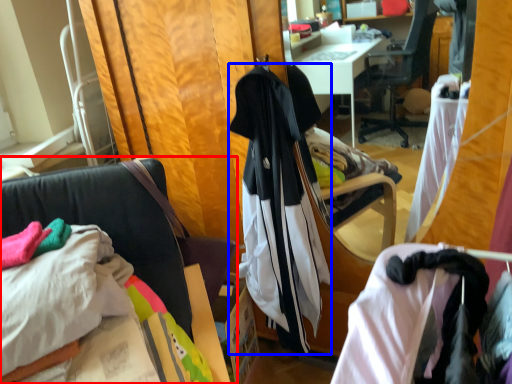
Question: Among these objects, which one is farthest to the camera, chair (highlighted by a red box) or garment (highlighted by a blue box)?

Choices:
 (A) chair
 (B) garment

Answer: (B)